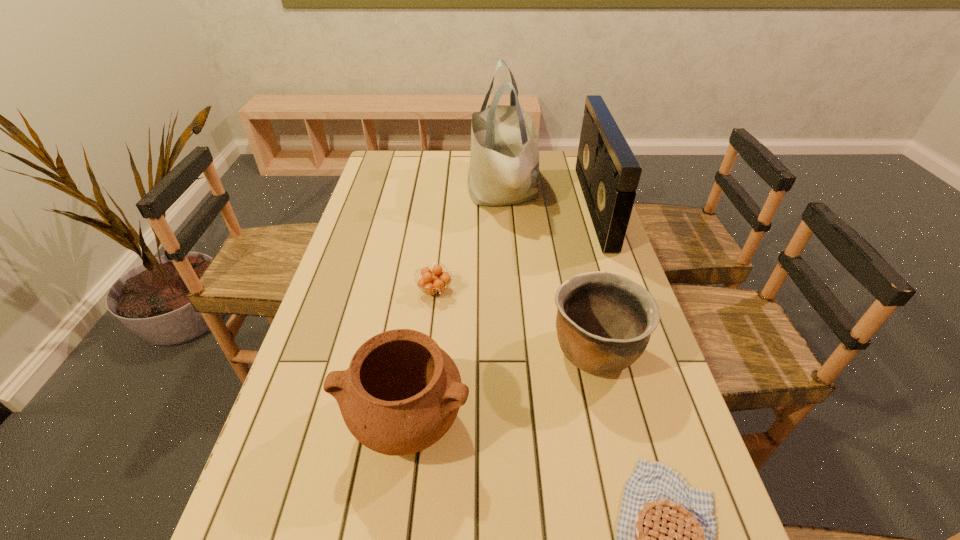
At what (x,y) coordinates should I click in order to perform the action: click on blank space at the left edge. Please return your answer as a coordinate pair (x, y). This screenshot has width=960, height=540. Looking at the image, I should click on (322, 462).

What are the coordinates of `free space at the right edge of the desktop` in the screenshot? It's located at pos(584,199).

Image resolution: width=960 pixels, height=540 pixels. I want to click on free spot at the far left corner of the desktop, so click(386, 161).

This screenshot has width=960, height=540. Find the location of `free space between the left pottery and the shopping bag`. free space between the left pottery and the shopping bag is located at coordinates (454, 305).

Find the location of a particular element. This screenshot has width=960, height=540. free space between the left pottery and the third shortest object is located at coordinates (501, 386).

This screenshot has height=540, width=960. In order to click on vacant area that lies between the orange fruit and the tallest object in this screenshot , I will do `click(468, 240)`.

Find the location of a particular element. The width and height of the screenshot is (960, 540). vacant space in between the shopping bag and the orange fruit is located at coordinates (468, 240).

Find the location of `vacant area that lies between the videotape and the shopping bag`. vacant area that lies between the videotape and the shopping bag is located at coordinates (548, 198).

You are a GUI agent. You are given a task and a screenshot of the screen. Output one action in this format:
    pyautogui.click(x=<x>, y=<y>)
    Task: Click on the object that stands as the third closest to the pie
    The width and height of the screenshot is (960, 540).
    Given the screenshot: What is the action you would take?
    pyautogui.click(x=430, y=281)

Point out which object is positioned as the fifth nearest to the tallest object. Please provide its 2D coordinates. Your answer should be formatted as a tuple, i.e. [(x, y)], where the tuple contains the x and y coordinates of a point satisfying the conditions above.

[(666, 531)]